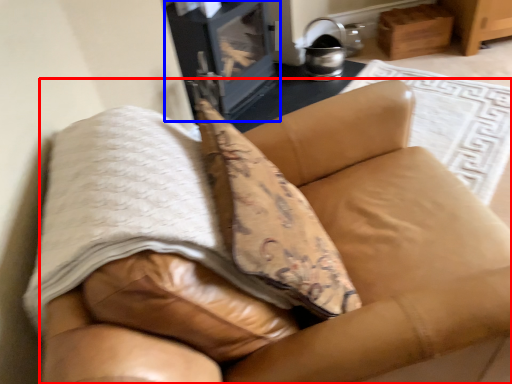
Question: Among these objects, which one is nearest to the camera, furniture (highlighted by a red box) or stove (highlighted by a blue box)?

Choices:
 (A) furniture
 (B) stove

Answer: (A)